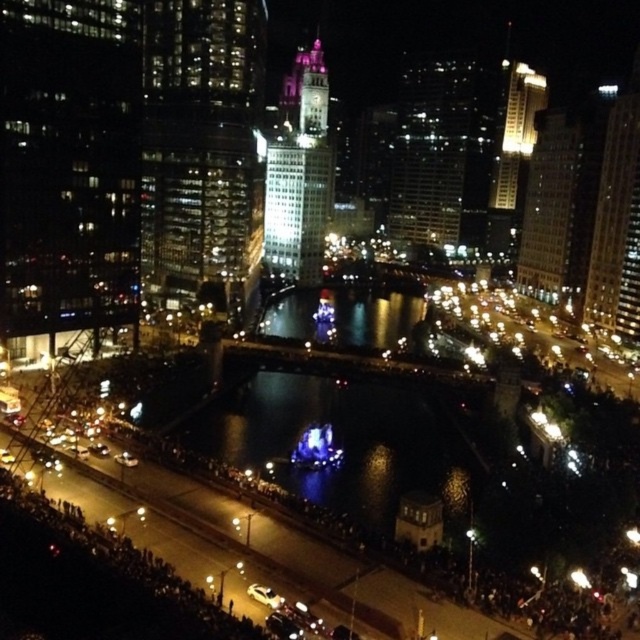
Question: Is glassy reflective skyscraper at upper left to the right of white glass skyscraper at upper right from the viewer's perspective?

Choices:
 (A) yes
 (B) no

Answer: (B)

Question: Estimate the real-world distances between objects in this image. Which object is closer to the matte glass skyscraper at upper right?

Choices:
 (A) glassy reflective skyscraper at upper left
 (B) white glossy building at upper right

Answer: (A)

Question: Can you confirm if white glass skyscraper at upper right is thinner than white glossy building at upper right?

Choices:
 (A) no
 (B) yes

Answer: (B)

Question: Which point is farther from the camera taking this photo?

Choices:
 (A) (298, 227)
 (B) (627, 157)
 (C) (296, 429)

Answer: (A)

Question: Does dark reflective water at center lie behind white glossy building at upper right?

Choices:
 (A) no
 (B) yes

Answer: (A)

Question: Which of the following is the closest to the observer?

Choices:
 (A) (289, 214)
 (B) (369, 484)
 (C) (150, 296)

Answer: (B)